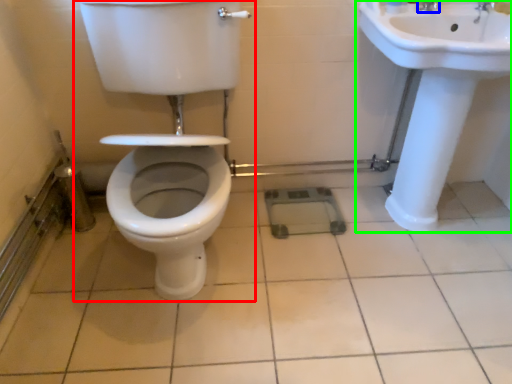
Question: Considering the real-world distances, which object is farthest from toilet (highlighted by a red box)? tap (highlighted by a blue box) or sink (highlighted by a green box)?

Choices:
 (A) tap
 (B) sink

Answer: (A)